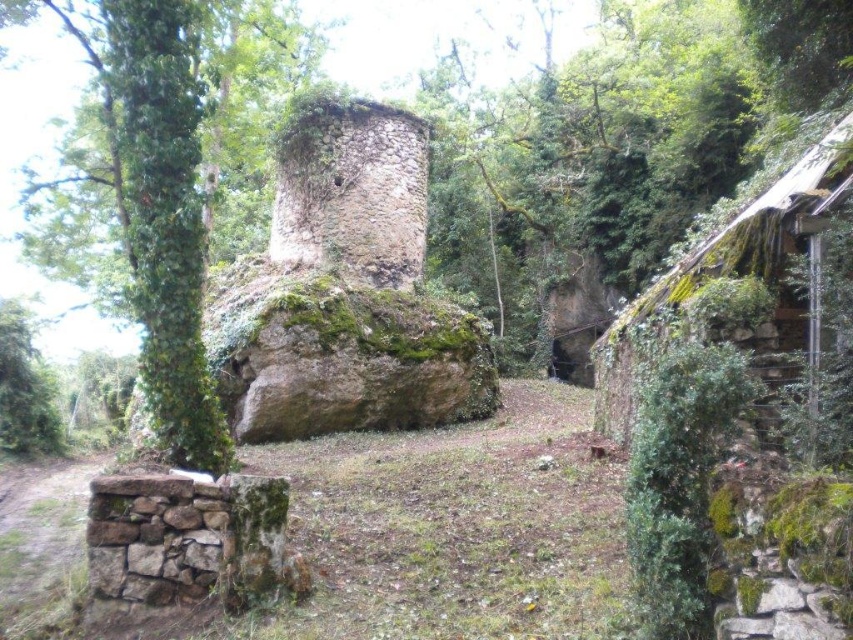
Who is lower down, green mossy tree at center-left or green mossy stone hut at right?

green mossy stone hut at right is below.

Is green mossy tree at center-left shorter than green mossy stone hut at right?

No.

You are a GUI agent. You are given a task and a screenshot of the screen. Output one action in this format:
    pyautogui.click(x=<x>, y=<y>)
    Task: Click on the green mossy tree at center-left
    The image size is (853, 640).
    Given the screenshot: What is the action you would take?
    pyautogui.click(x=161, y=168)

At what (x,y) coordinates should I click in order to perform the action: click on green mossy tree at center-left. Please return your answer as a coordinate pair (x, y). The image size is (853, 640). Looking at the image, I should click on (161, 168).

Who is more forward, (x=346, y=323) or (x=772, y=362)?

Point (x=772, y=362) is more forward.

Can you confirm if mossy stone ruins at center is bigger than green mossy stone hut at right?

Yes, mossy stone ruins at center is bigger than green mossy stone hut at right.

You are a GUI agent. You are given a task and a screenshot of the screen. Output one action in this format:
    pyautogui.click(x=<x>, y=<y>)
    Task: Click on the mossy stone ruins at center
    The image size is (853, 640).
    Given the screenshot: What is the action you would take?
    pyautogui.click(x=345, y=292)

The height and width of the screenshot is (640, 853). What are the coordinates of `mossy stone ruins at center` in the screenshot? It's located at (345, 292).

Is green mossy tree at center-left to the left of mossy stone ruins at center from the viewer's perspective?

Indeed, green mossy tree at center-left is positioned on the left side of mossy stone ruins at center.

Who is taller, green mossy tree at center-left or mossy stone ruins at center?

Standing taller between the two is green mossy tree at center-left.

Does point (50, 253) come behind point (260, 422)?

That is True.

The width and height of the screenshot is (853, 640). In order to click on green mossy tree at center-left in this screenshot , I will do `click(161, 168)`.